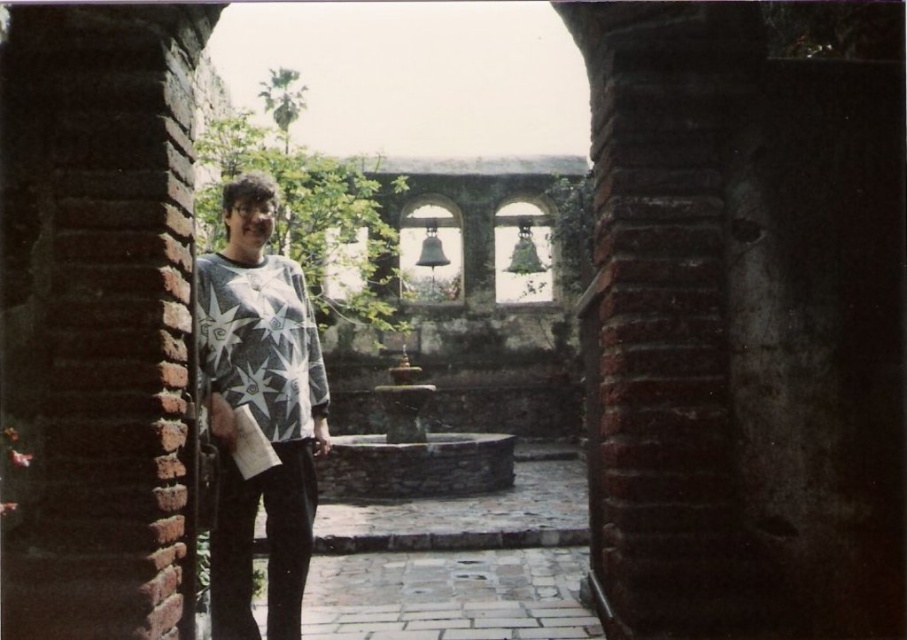
Is the position of white star-patterned sweater at center more distant than that of white printed sweater at center?

That is False.

Who is more forward, (261, 355) or (285, 342)?

Point (261, 355) is in front.

Who is more distant from viewer, (250, 515) or (200, 356)?

Positioned behind is point (250, 515).

I want to click on white star-patterned sweater at center, so click(259, 410).